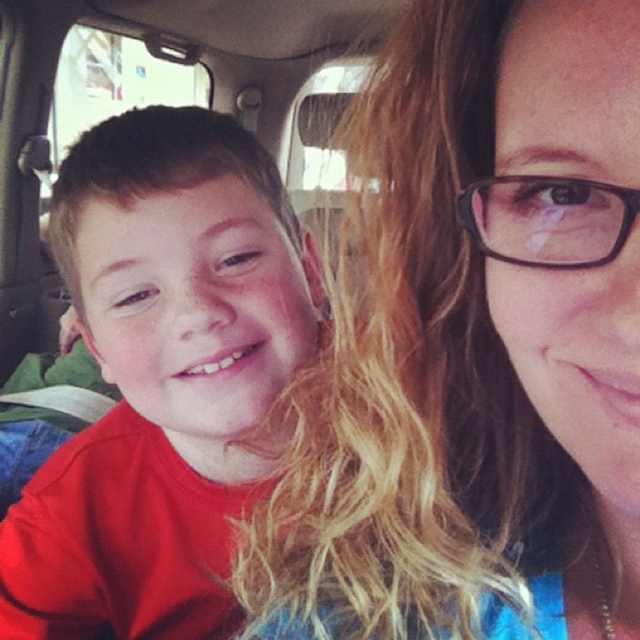
Question: Considering the relative positions of blonde hair at center and matte red shirt at left in the image provided, where is blonde hair at center located with respect to matte red shirt at left?

Choices:
 (A) left
 (B) right

Answer: (B)

Question: Can you confirm if blonde hair at center is smaller than matte red shirt at left?

Choices:
 (A) no
 (B) yes

Answer: (B)

Question: Does blonde hair at center have a larger size compared to matte red shirt at left?

Choices:
 (A) no
 (B) yes

Answer: (A)

Question: Which of the following is the farthest from the observer?

Choices:
 (A) blonde hair at center
 (B) matte red shirt at left

Answer: (B)

Question: Which object appears farthest from the camera in this image?

Choices:
 (A) matte red shirt at left
 (B) blonde hair at center

Answer: (A)